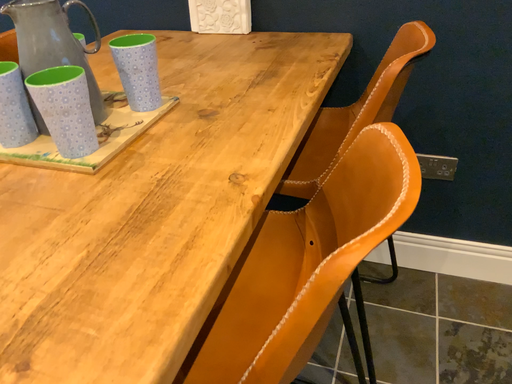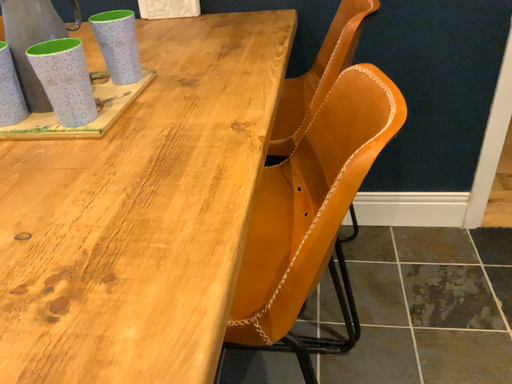
Question: How did the camera likely rotate when shooting the video?

Choices:
 (A) rotated right
 (B) rotated left

Answer: (A)